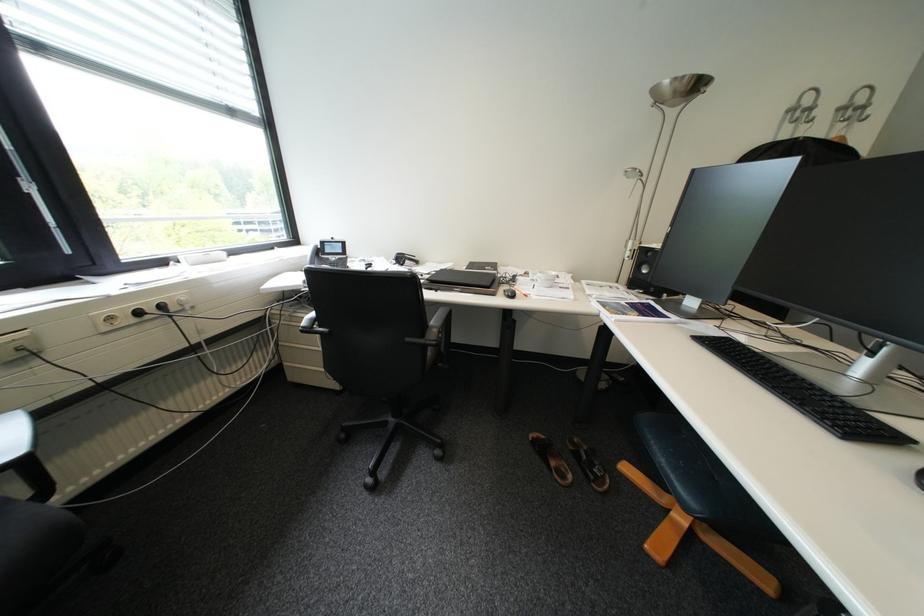
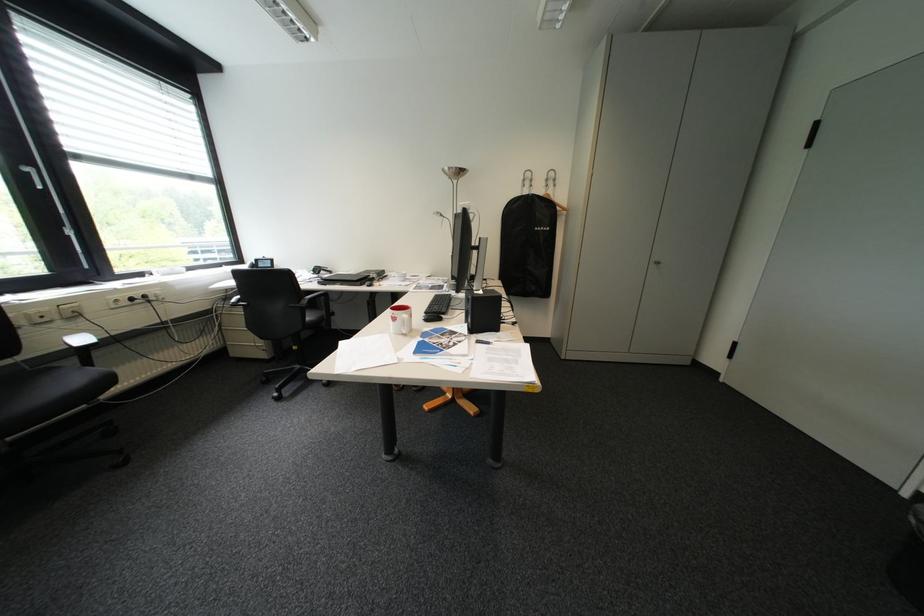
From the picture: What movement of the cameraman would produce the second image?

The cameraman walked toward right, backward.